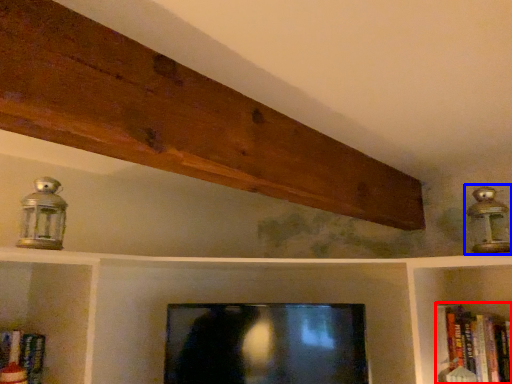
Question: Which of the following is the closest to the observer, book (highlighted by a red box) or lamp (highlighted by a blue box)?

Choices:
 (A) book
 (B) lamp

Answer: (B)